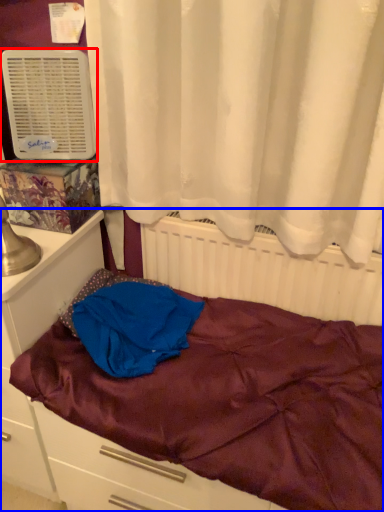
Question: Among these objects, which one is nearest to the camera, air conditioning (highlighted by a red box) or bed (highlighted by a blue box)?

Choices:
 (A) air conditioning
 (B) bed

Answer: (B)